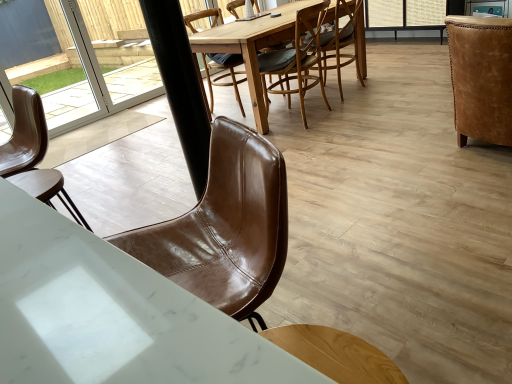
The image size is (512, 384). I want to click on spots to the right of brown leather chair at center, the second chair from the left, so click(272, 8).